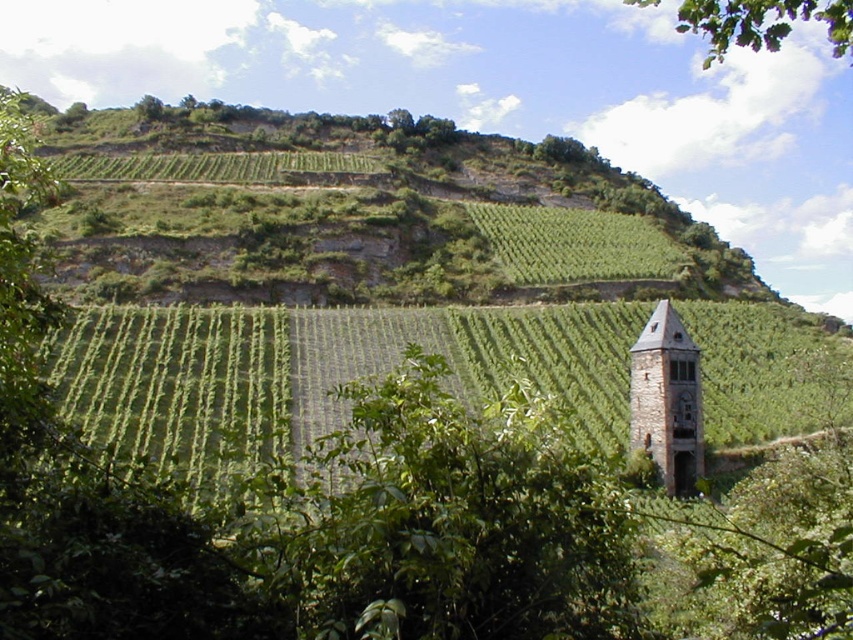
Question: Is brown stone bell tower at right to the right of green leafy tree at upper right from the viewer's perspective?

Choices:
 (A) no
 (B) yes

Answer: (A)

Question: Which object appears farthest from the camera in this image?

Choices:
 (A) green leafy tree at upper right
 (B) brown stone bell tower at right

Answer: (B)

Question: Does brown stone bell tower at right have a greater width compared to green leafy tree at upper right?

Choices:
 (A) no
 (B) yes

Answer: (A)

Question: Which point appears farthest from the camera in this image?

Choices:
 (A) (689, 413)
 (B) (842, 3)

Answer: (A)

Question: Can you confirm if brown stone bell tower at right is wider than green leafy tree at upper right?

Choices:
 (A) yes
 (B) no

Answer: (B)